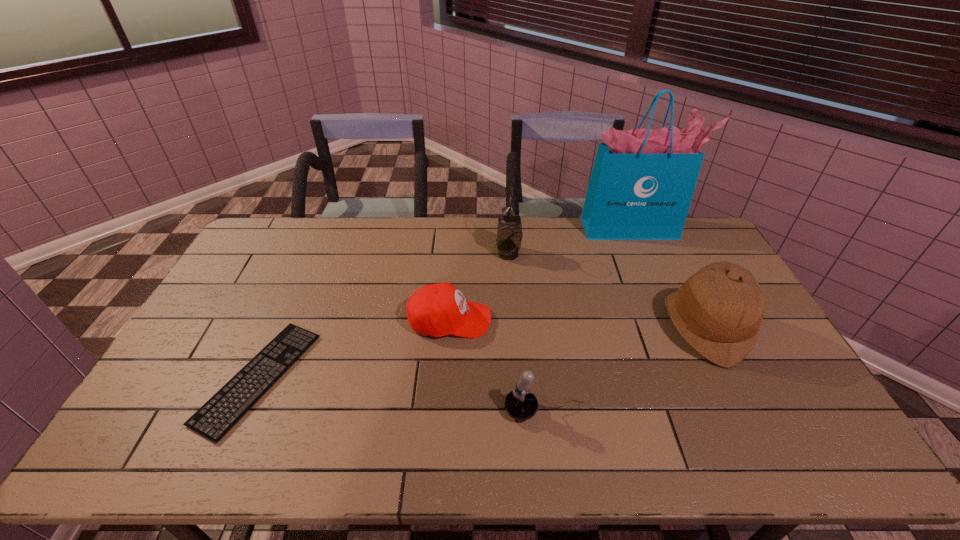
Locate an element on the screen. shopping bag is located at coordinates (642, 182).

Locate an element on the screen. This screenshot has height=540, width=960. the tallest object is located at coordinates (642, 182).

You are a GUI agent. You are given a task and a screenshot of the screen. Output one action in this format:
    pyautogui.click(x=<x>, y=<y>)
    Task: Click on the second farthest object
    The width and height of the screenshot is (960, 540).
    Given the screenshot: What is the action you would take?
    pyautogui.click(x=509, y=228)

Where is `hat`? hat is located at coordinates (718, 311).

Where is `microphone`? This screenshot has height=540, width=960. microphone is located at coordinates (520, 404).

Find the location of a particular element. Image resolution: width=960 pixels, height=540 pixels. baseball cap is located at coordinates (437, 310).

The image size is (960, 540). What are the coordinates of `the fifth tallest object` in the screenshot? It's located at coord(437,310).

Locate an element on the screen. The height and width of the screenshot is (540, 960). the shortest object is located at coordinates click(x=223, y=410).

Locate an element on the screen. Image resolution: width=960 pixels, height=540 pixels. the leftmost object is located at coordinates [223, 410].

Find the location of a particular element. vacant space located on the front of the tallest object is located at coordinates (667, 309).